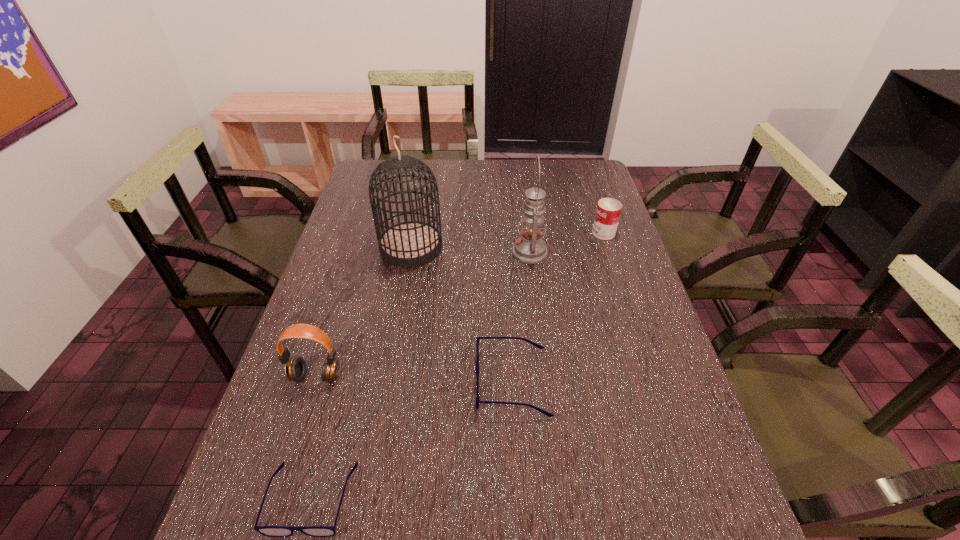
What are the coordinates of `birdcage positioned at the left edge` in the screenshot? It's located at (412, 243).

This screenshot has height=540, width=960. I want to click on headset that is at the left edge, so click(295, 368).

You are a GUI agent. You are given a task and a screenshot of the screen. Output one action in this format:
    pyautogui.click(x=<x>, y=<y>)
    Task: Click on the object located at the right edge
    The height and width of the screenshot is (540, 960).
    Given the screenshot: What is the action you would take?
    pyautogui.click(x=608, y=211)

Identify the location of object located at the near left corner. The width and height of the screenshot is (960, 540). (270, 531).

This screenshot has width=960, height=540. I want to click on blank space at the far edge, so click(x=552, y=167).

Locate an element on the screen. Image resolution: width=960 pixels, height=540 pixels. free location at the near edge is located at coordinates (619, 464).

The image size is (960, 540). I want to click on vacant space at the left edge, so click(x=346, y=212).

Locate an element on the screen. The image size is (960, 540). free space at the right edge of the desktop is located at coordinates point(588,279).

The image size is (960, 540). In order to click on vacant space at the far right corner of the desktop in this screenshot , I will do `click(557, 174)`.

Find the location of a particular element. This screenshot has height=540, width=960. vacant space at the near right corner of the desktop is located at coordinates (705, 470).